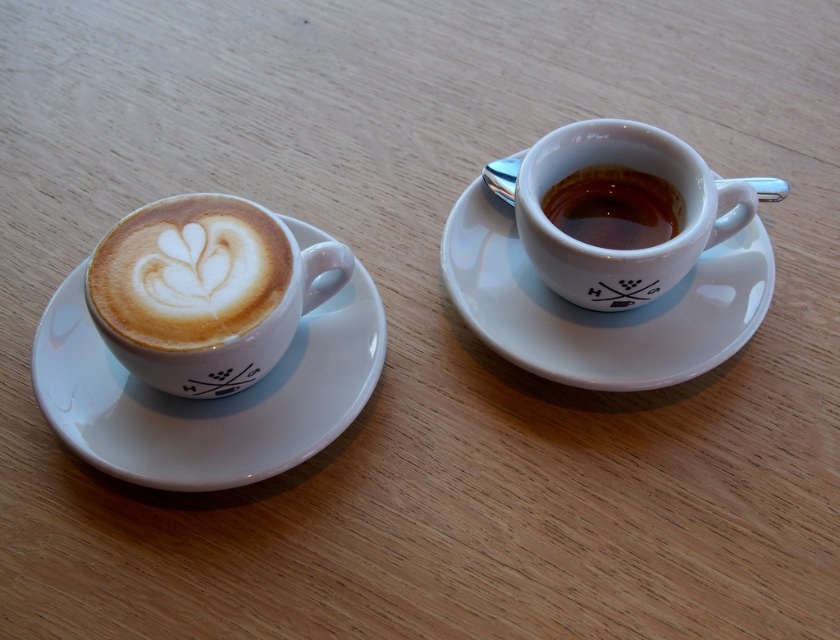
Does white glossy saucer at right appear under latte art at left?

Incorrect, white glossy saucer at right is not positioned below latte art at left.

Is white glossy saucer at right above latte art at left?

Indeed, white glossy saucer at right is positioned over latte art at left.

Is point (722, 253) positioned behind point (119, 296)?

Yes, it is behind point (119, 296).

Where is `white glossy saucer at right`? The image size is (840, 640). white glossy saucer at right is located at coordinates (599, 310).

Does matte ceramic espresso cup at right appear on the right side of shiny ceramic espresso cup at right?

Correct, you'll find matte ceramic espresso cup at right to the right of shiny ceramic espresso cup at right.

Which is behind, point (714, 211) or point (630, 170)?

The point (630, 170) is behind.

Where is `matte ceramic espresso cup at right`? The image size is (840, 640). matte ceramic espresso cup at right is located at coordinates (617, 250).

Which is above, white glossy saucer at right or shiny ceramic espresso cup at right?

shiny ceramic espresso cup at right is higher up.

Does point (748, 284) come in front of point (654, 237)?

Yes, point (748, 284) is closer to viewer.

Locate an element on the screen. white glossy saucer at right is located at coordinates (599, 310).